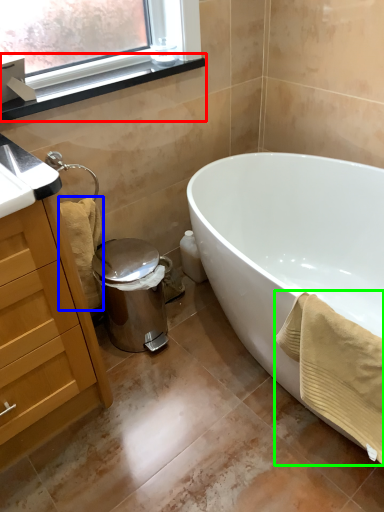
Question: Which is farther away from window sill (highlighted by a red box)? bath towel (highlighted by a blue box) or bath towel (highlighted by a green box)?

Choices:
 (A) bath towel
 (B) bath towel

Answer: (B)